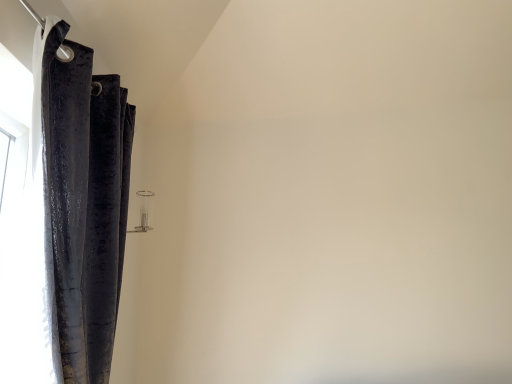
Describe the element at coordinates (81, 199) in the screenshot. This screenshot has width=512, height=384. I see `velvet dark blue curtain at left` at that location.

This screenshot has width=512, height=384. I want to click on velvet dark blue curtain at left, so click(x=81, y=199).

I want to click on velvet dark blue curtain at left, so click(x=81, y=199).